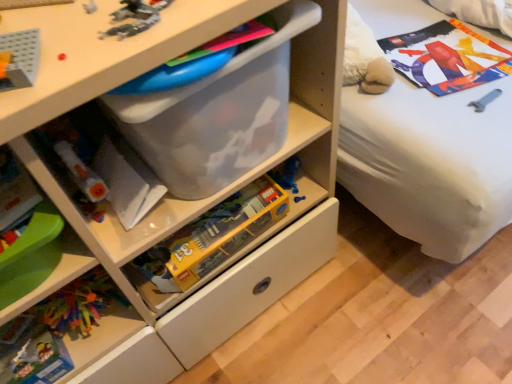
Question: Can you confirm if transparent plastic chest of drawers at center is taller than translucent plastic lego box at center, which is the first toy in back-to-front order?

Choices:
 (A) no
 (B) yes

Answer: (B)

Question: Could you tell me if transparent plastic chest of drawers at center is turned towards translucent plastic lego box at center, which is the first toy in back-to-front order?

Choices:
 (A) yes
 (B) no

Answer: (A)

Question: From a real-world perspective, is transparent plastic chest of drawers at center beneath translucent plastic lego box at center, marked as the 2th toy in a front-to-back arrangement?

Choices:
 (A) yes
 (B) no

Answer: (B)

Question: Is transparent plastic chest of drawers at center bigger than translucent plastic lego box at center, the second toy when ordered from top to bottom?

Choices:
 (A) no
 (B) yes

Answer: (B)

Question: Would you say transparent plastic chest of drawers at center contains translucent plastic lego box at center, the first toy when ordered from bottom to top?

Choices:
 (A) yes
 (B) no

Answer: (A)

Question: Considering the positions of point (126, 29) and point (57, 29), is point (126, 29) closer or farther from the camera than point (57, 29)?

Choices:
 (A) farther
 (B) closer

Answer: (B)

Question: Is translucent plastic toy at upper left, which is counted as the 2th toy, starting from the back, wider or thinner than transparent plastic chest of drawers at center?

Choices:
 (A) thin
 (B) wide

Answer: (A)

Question: In terms of height, does translucent plastic toy at upper left, the second toy ordered from the bottom, look taller or shorter compared to transparent plastic chest of drawers at center?

Choices:
 (A) short
 (B) tall

Answer: (A)

Question: From the image's perspective, is translucent plastic toy at upper left, the first toy when ordered from top to bottom, above or below transparent plastic chest of drawers at center?

Choices:
 (A) above
 (B) below

Answer: (A)

Question: Is point (105, 319) positioned closer to the camera than point (152, 24)?

Choices:
 (A) farther
 (B) closer

Answer: (A)

Question: From a real-world perspective, relative to translucent plastic toy at upper left, the second toy ordered from the bottom, is multicolored plastic toys at lower left vertically above or below?

Choices:
 (A) above
 (B) below

Answer: (B)

Question: Is multicolored plastic toys at lower left bigger or smaller than translucent plastic toy at upper left, the second toy ordered from the bottom?

Choices:
 (A) big
 (B) small

Answer: (B)

Question: Considering the positions of multicolored plastic toys at lower left and translucent plastic toy at upper left, positioned as the first toy in front-to-back order, in the image, is multicolored plastic toys at lower left wider or thinner than translucent plastic toy at upper left, positioned as the first toy in front-to-back order,?

Choices:
 (A) wide
 (B) thin

Answer: (B)

Question: From a real-world perspective, is translucent plastic toy at upper left, which is counted as the 2th toy, starting from the back, above or below translucent plastic lego box at center, marked as the 2th toy in a front-to-back arrangement?

Choices:
 (A) below
 (B) above

Answer: (B)

Question: Looking at the image, does translucent plastic toy at upper left, the first toy when ordered from top to bottom, seem bigger or smaller compared to translucent plastic lego box at center, marked as the 2th toy in a front-to-back arrangement?

Choices:
 (A) big
 (B) small

Answer: (B)